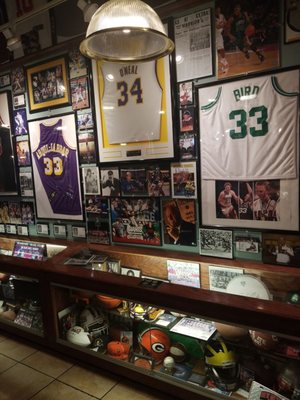
Identify the location of floor. The image size is (300, 400). (89, 380), (117, 390), (40, 381), (55, 387), (53, 366), (24, 352), (9, 365).